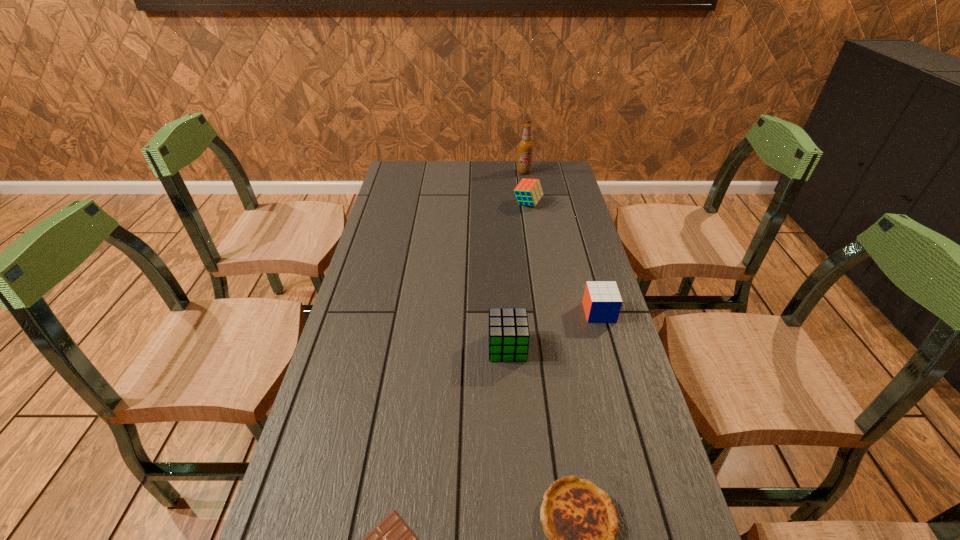
Locate an element on the screen. Image resolution: width=960 pixels, height=540 pixels. vacant area located 0.110m on the front of the leftmost cube is located at coordinates (511, 400).

Image resolution: width=960 pixels, height=540 pixels. In order to click on free space located 0.290m on the left of the third farthest object in this screenshot , I will do `click(481, 312)`.

This screenshot has height=540, width=960. I want to click on object at the far edge, so click(526, 146).

Where is `beer bottle at the right edge`? The width and height of the screenshot is (960, 540). beer bottle at the right edge is located at coordinates [x=526, y=146].

The height and width of the screenshot is (540, 960). Identify the location of object at the far right corner. (526, 146).

This screenshot has width=960, height=540. In order to click on vacant space at the far edge of the desktop in this screenshot , I will do `click(457, 178)`.

The image size is (960, 540). In order to click on vacant region at the left edge of the desktop in this screenshot , I will do `click(383, 321)`.

In the image, there is a desktop. At what (x,y) coordinates should I click in order to perform the action: click on free region at the right edge. Please return your answer as a coordinate pair (x, y). Image resolution: width=960 pixels, height=540 pixels. Looking at the image, I should click on (545, 200).

What are the coordinates of `vacant area at the far left corner of the desktop` in the screenshot? It's located at (400, 185).

At what (x,y) coordinates should I click in order to perform the action: click on vacant space at the far right corner of the desktop. Please return your answer as a coordinate pair (x, y). Image resolution: width=960 pixels, height=540 pixels. Looking at the image, I should click on [564, 178].